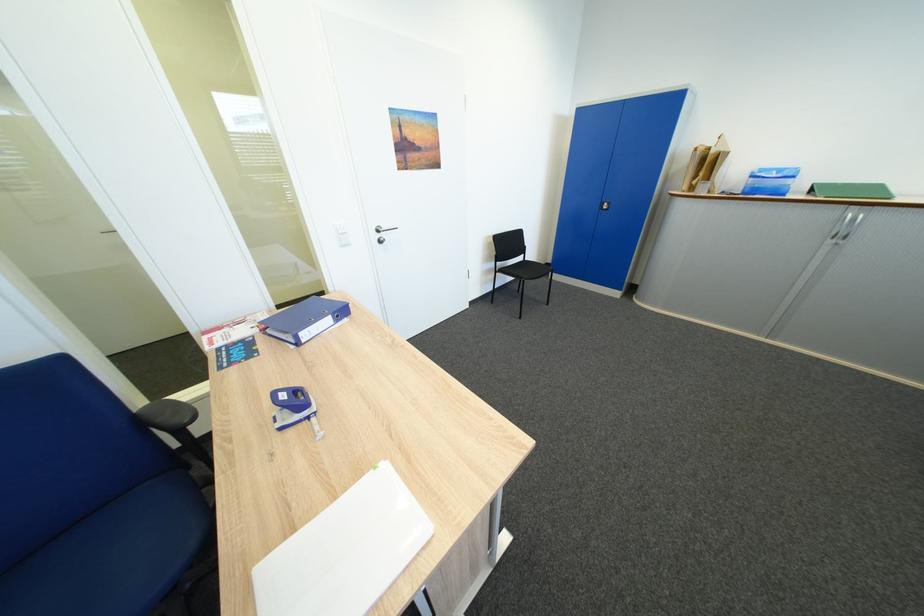
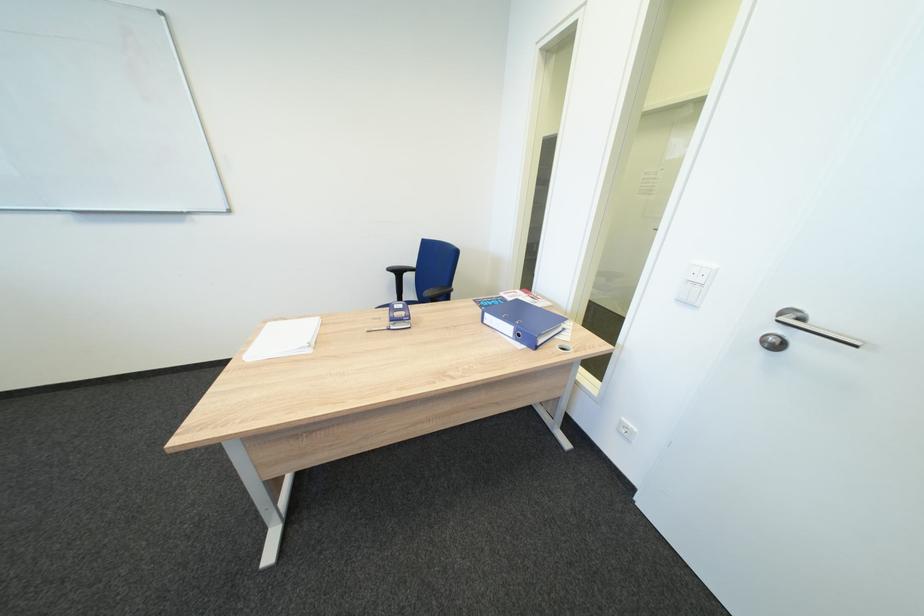
The point at (313, 342) is marked in the first image. Where is the corresponding point in the second image?

(495, 323)